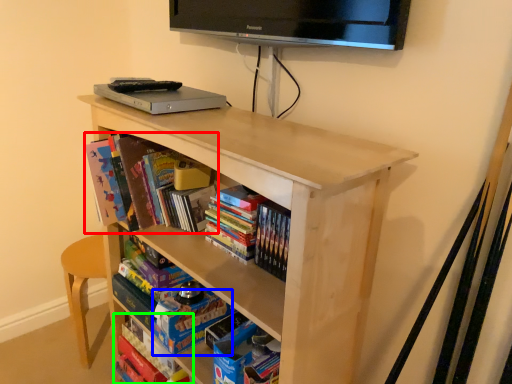
Question: Estimate the real-world distances between objects in this image. Which object is farther from book (highlighted by a red box), paperback book (highlighted by a blue box) or book (highlighted by a green box)?

Choices:
 (A) paperback book
 (B) book

Answer: (B)